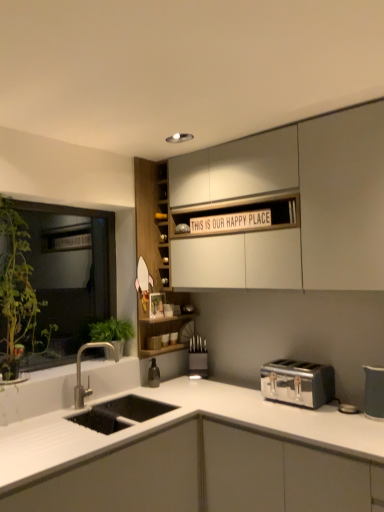
Describe the element at coordinates (272, 200) in the screenshot. The image size is (384, 512). I see `white matte cabinet at upper center, positioned as the third cabinetry in bottom-to-top order` at that location.

You are a GUI agent. You are given a task and a screenshot of the screen. Output one action in this format:
    pyautogui.click(x=<x>, y=<y>)
    Task: Click on the green leafy plant at left
    The width and height of the screenshot is (384, 512).
    Given the screenshot: What is the action you would take?
    pyautogui.click(x=52, y=279)

Measure the distance between wooden cabinet at center, which is the 2th cabinetry from bottom to top, and camera.

9.10 feet.

You are a GUI agent. You are given a task and a screenshot of the screen. Output one action in this format:
    pyautogui.click(x=<x>, y=<y>)
    Task: Click on the white matte countertop at lower left, which appears as the third cabinetry when viewed from the top
    
    Given the screenshot: What is the action you would take?
    pyautogui.click(x=208, y=475)

Which of these two, satin nickel faucet at lower left or green leafy plant at left, is smaller?

Smaller between the two is satin nickel faucet at lower left.

Is satin nickel faucet at lower left positioned beyond the bounds of green leafy plant at left?

Yes, satin nickel faucet at lower left is not within green leafy plant at left.

Between satin nickel faucet at lower left and green leafy plant at left, which one has smaller width?

green leafy plant at left.

Is satin nickel faucet at lower left far from green leafy plant at left?

That's not correct — satin nickel faucet at lower left is a little close to green leafy plant at left.

Does point (363, 486) appear closer or farther from the camera than point (24, 268)?

Point (363, 486).

From a real-world perspective, is white matte countertop at lower left, which appears as the third cabinetry when viewed from the top, below green leafy plant at left?

Indeed, from a real-world perspective, white matte countertop at lower left, which appears as the third cabinetry when viewed from the top, is positioned beneath green leafy plant at left.

Between white matte countertop at lower left, which is counted as the first cabinetry, starting from the bottom, and green leafy plant at left, which one has smaller size?

green leafy plant at left.

Considering the relative sizes of wooden cabinet at center, the second cabinetry viewed from the top, and satin nickel faucet at lower left in the image provided, is wooden cabinet at center, the second cabinetry viewed from the top, smaller than satin nickel faucet at lower left?

Actually, wooden cabinet at center, the second cabinetry viewed from the top, might be larger than satin nickel faucet at lower left.

Considering the sizes of objects wooden cabinet at center, the second cabinetry viewed from the top, and satin nickel faucet at lower left in the image provided, who is wider, wooden cabinet at center, the second cabinetry viewed from the top, or satin nickel faucet at lower left?

wooden cabinet at center, the second cabinetry viewed from the top.

Is wooden cabinet at center, which is the 2th cabinetry from bottom to top, looking in the opposite direction of satin nickel faucet at lower left?

No, wooden cabinet at center, which is the 2th cabinetry from bottom to top, is not facing the opposite direction of satin nickel faucet at lower left.

Which object is closer to the camera, wooden cabinet at center, the second cabinetry viewed from the top, or satin nickel faucet at lower left?

Positioned in front is satin nickel faucet at lower left.

Which is closer, (366, 482) or (286, 393)?

Point (366, 482) appears to be closer to the viewer than point (286, 393).

From the image's perspective, is white matte countertop at lower left, which is counted as the first cabinetry, starting from the bottom, on top of satin chrome toaster at lower right?

No.

Choose the correct answer: Is white matte countertop at lower left, which is counted as the first cabinetry, starting from the bottom, inside satin chrome toaster at lower right or outside it?

white matte countertop at lower left, which is counted as the first cabinetry, starting from the bottom, exists outside the volume of satin chrome toaster at lower right.

Are white matte countertop at lower left, which appears as the third cabinetry when viewed from the top, and satin chrome toaster at lower right located far from each other?

Actually, white matte countertop at lower left, which appears as the third cabinetry when viewed from the top, and satin chrome toaster at lower right are a little close together.

Could you tell me if white matte countertop at lower left, which is counted as the first cabinetry, starting from the bottom, is turned towards satin nickel faucet at lower left?

No, white matte countertop at lower left, which is counted as the first cabinetry, starting from the bottom, does not turn towards satin nickel faucet at lower left.

Which is behind, white matte countertop at lower left, which is counted as the first cabinetry, starting from the bottom, or satin nickel faucet at lower left?

satin nickel faucet at lower left is more distant.

Is white matte countertop at lower left, which appears as the third cabinetry when viewed from the top, far from satin nickel faucet at lower left?

white matte countertop at lower left, which appears as the third cabinetry when viewed from the top, is near satin nickel faucet at lower left, not far away.

Can you confirm if white matte countertop at lower left, which appears as the third cabinetry when viewed from the top, is thinner than satin nickel faucet at lower left?

In fact, white matte countertop at lower left, which appears as the third cabinetry when viewed from the top, might be wider than satin nickel faucet at lower left.

How different are the orientations of wooden cabinet at center, which is the 2th cabinetry from bottom to top, and white matte countertop at lower left, which appears as the third cabinetry when viewed from the top, in degrees?

The angle between the facing direction of wooden cabinet at center, which is the 2th cabinetry from bottom to top, and the facing direction of white matte countertop at lower left, which appears as the third cabinetry when viewed from the top, is 90 degrees.

Who is bigger, wooden cabinet at center, the second cabinetry viewed from the top, or white matte countertop at lower left, which is counted as the first cabinetry, starting from the bottom?

Bigger between the two is white matte countertop at lower left, which is counted as the first cabinetry, starting from the bottom.

Is wooden cabinet at center, the second cabinetry viewed from the top, located outside white matte countertop at lower left, which appears as the third cabinetry when viewed from the top?

Yes, wooden cabinet at center, the second cabinetry viewed from the top, is not within white matte countertop at lower left, which appears as the third cabinetry when viewed from the top.

This screenshot has height=512, width=384. Find the location of `the 2nd cabinetry behind when counting from the white matte countertop at lower left, which is counted as the first cabinetry, starting from the bottom`. the 2nd cabinetry behind when counting from the white matte countertop at lower left, which is counted as the first cabinetry, starting from the bottom is located at coordinates (154, 224).

Can you confirm if white matte cabinet at upper center, positioned as the third cabinetry in bottom-to-top order, is bigger than green leafy plant at left?

Correct, white matte cabinet at upper center, positioned as the third cabinetry in bottom-to-top order, is larger in size than green leafy plant at left.

Considering the sizes of white matte cabinet at upper center, positioned as the third cabinetry in bottom-to-top order, and green leafy plant at left in the image, is white matte cabinet at upper center, positioned as the third cabinetry in bottom-to-top order, taller or shorter than green leafy plant at left?

In the image, white matte cabinet at upper center, positioned as the third cabinetry in bottom-to-top order, appears to be shorter than green leafy plant at left.

Consider the image. Can you see white matte cabinet at upper center, positioned as the third cabinetry in bottom-to-top order, touching green leafy plant at left?

white matte cabinet at upper center, positioned as the third cabinetry in bottom-to-top order, and green leafy plant at left are not in contact.

From the picture: From a real-world perspective, is white matte cabinet at upper center, which is counted as the 1th cabinetry, starting from the top, located beneath green leafy plant at left?

No, from a real-world perspective, white matte cabinet at upper center, which is counted as the 1th cabinetry, starting from the top, is not beneath green leafy plant at left.

Find the location of a particular element. This screenshot has width=384, height=512. tap that is on the right side of green leafy plant at left is located at coordinates pos(80,371).

Locate an element on the screen. The width and height of the screenshot is (384, 512). cabinetry below the green leafy plant at left (from a real-world perspective) is located at coordinates (208, 475).

Which object lies nearer to the anchor point wooden cabinet at center, which is the 2th cabinetry from bottom to top, satin nickel faucet at lower left or white matte countertop at lower left, which is counted as the first cabinetry, starting from the bottom?

satin nickel faucet at lower left lies closer to wooden cabinet at center, which is the 2th cabinetry from bottom to top, than the other object.

When comparing their distances from white matte countertop at lower left, which appears as the third cabinetry when viewed from the top, does wooden cabinet at center, which is the 2th cabinetry from bottom to top, or satin chrome toaster at lower right seem closer?

Based on the image, satin chrome toaster at lower right appears to be nearer to white matte countertop at lower left, which appears as the third cabinetry when viewed from the top.

When comparing their distances from wooden cabinet at center, which is the 2th cabinetry from bottom to top, does matte gray pitcher at right, positioned as the 2th appliance in left-to-right order, or white matte countertop at lower left, which is counted as the first cabinetry, starting from the bottom, seem closer?

white matte countertop at lower left, which is counted as the first cabinetry, starting from the bottom.

Which object lies further to the anchor point satin nickel faucet at lower left, white matte countertop at lower left, which appears as the third cabinetry when viewed from the top, or wooden cabinet at center, the second cabinetry viewed from the top?

Among the two, white matte countertop at lower left, which appears as the third cabinetry when viewed from the top, is located further to satin nickel faucet at lower left.

From the image, which object appears to be farther from white matte cabinet at upper center, which is counted as the 1th cabinetry, starting from the top, satin chrome toaster at lower right or satin nickel faucet at lower left?

The object further to white matte cabinet at upper center, which is counted as the 1th cabinetry, starting from the top, is satin nickel faucet at lower left.

Estimate the real-world distances between objects in this image. Which object is further from white matte cabinet at upper center, which is counted as the 1th cabinetry, starting from the top, green leafy plant at left or satin chrome toaster at lower right?

green leafy plant at left.

Estimate the real-world distances between objects in this image. Which object is further from white matte cabinet at upper center, which is counted as the 1th cabinetry, starting from the top, white matte countertop at lower left, which appears as the third cabinetry when viewed from the top, or satin chrome toaster at lower right?

white matte countertop at lower left, which appears as the third cabinetry when viewed from the top, lies further to white matte cabinet at upper center, which is counted as the 1th cabinetry, starting from the top, than the other object.

Looking at the image, which one is located closer to white matte countertop at lower left, which appears as the third cabinetry when viewed from the top, matte gray pitcher at right, placed as the second appliance when sorted from back to front, or white matte cabinet at upper center, positioned as the third cabinetry in bottom-to-top order?

Among the two, matte gray pitcher at right, placed as the second appliance when sorted from back to front, is located nearer to white matte countertop at lower left, which appears as the third cabinetry when viewed from the top.

The image size is (384, 512). Find the location of `toaster that lies between white matte cabinet at upper center, which is counted as the 1th cabinetry, starting from the top, and white matte countertop at lower left, which is counted as the first cabinetry, starting from the bottom, from top to bottom`. toaster that lies between white matte cabinet at upper center, which is counted as the 1th cabinetry, starting from the top, and white matte countertop at lower left, which is counted as the first cabinetry, starting from the bottom, from top to bottom is located at coordinates (298, 382).

Image resolution: width=384 pixels, height=512 pixels. In order to click on tap between white matte countertop at lower left, which is counted as the first cabinetry, starting from the bottom, and metallic knife block at center, the second appliance when ordered from front to back, from front to back in this screenshot , I will do `click(80, 371)`.

The height and width of the screenshot is (512, 384). Find the location of `toaster between white matte countertop at lower left, which is counted as the first cabinetry, starting from the bottom, and wooden cabinet at center, the second cabinetry viewed from the top, from front to back`. toaster between white matte countertop at lower left, which is counted as the first cabinetry, starting from the bottom, and wooden cabinet at center, the second cabinetry viewed from the top, from front to back is located at coordinates tap(298, 382).

This screenshot has width=384, height=512. I want to click on cabinetry between white matte cabinet at upper center, which is counted as the 1th cabinetry, starting from the top, and satin chrome toaster at lower right, in the vertical direction, so click(154, 224).